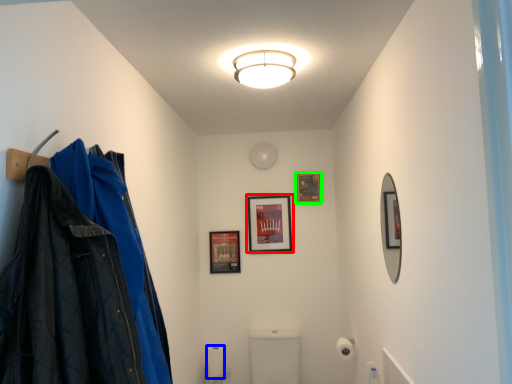
Question: Which object is the closest to the picture frame (highlighted by a red box)? Choose among these: toilet paper (highlighted by a blue box) or picture frame (highlighted by a green box).

Choices:
 (A) toilet paper
 (B) picture frame

Answer: (B)